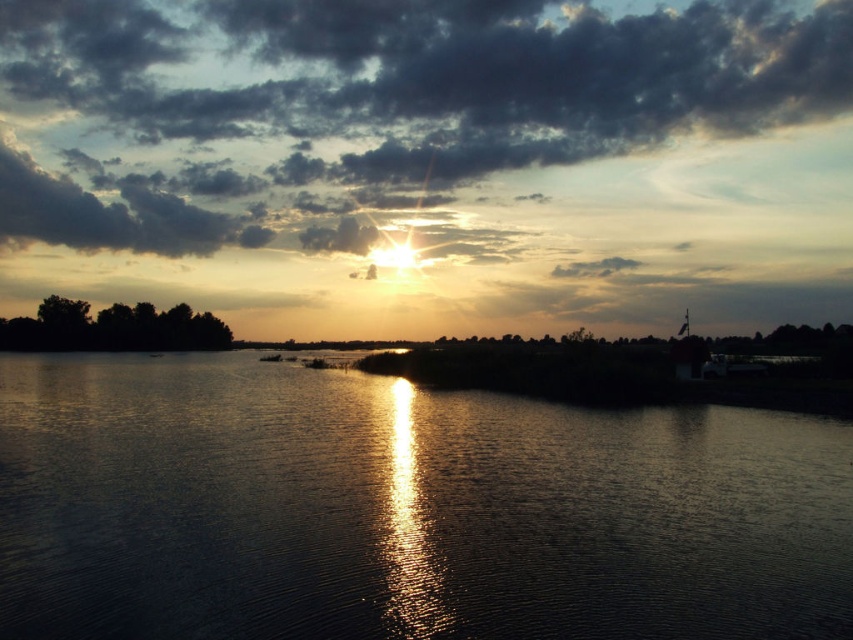
Which of these two, silvery reflective water at center or smokey gray cloud at upper center, stands taller?

With more height is smokey gray cloud at upper center.

Is silvery reflective water at center behind smokey gray cloud at upper center?

No, silvery reflective water at center is in front of smokey gray cloud at upper center.

This screenshot has height=640, width=853. What do you see at coordinates (402, 509) in the screenshot?
I see `silvery reflective water at center` at bounding box center [402, 509].

Where is `silvery reflective water at center`? This screenshot has width=853, height=640. silvery reflective water at center is located at coordinates (402, 509).